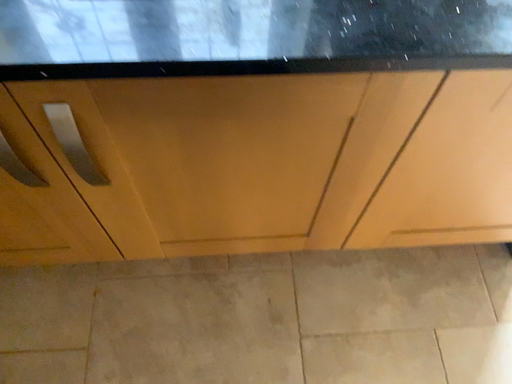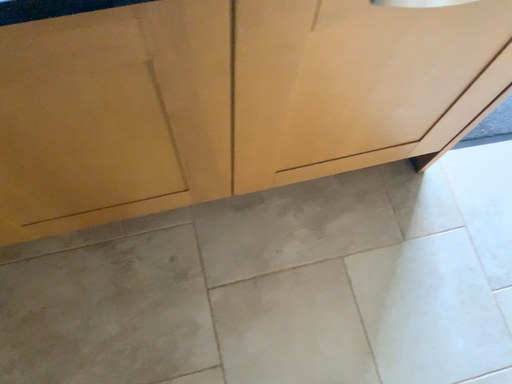
Question: Which way did the camera rotate in the video?

Choices:
 (A) rotated upward
 (B) rotated downward

Answer: (B)